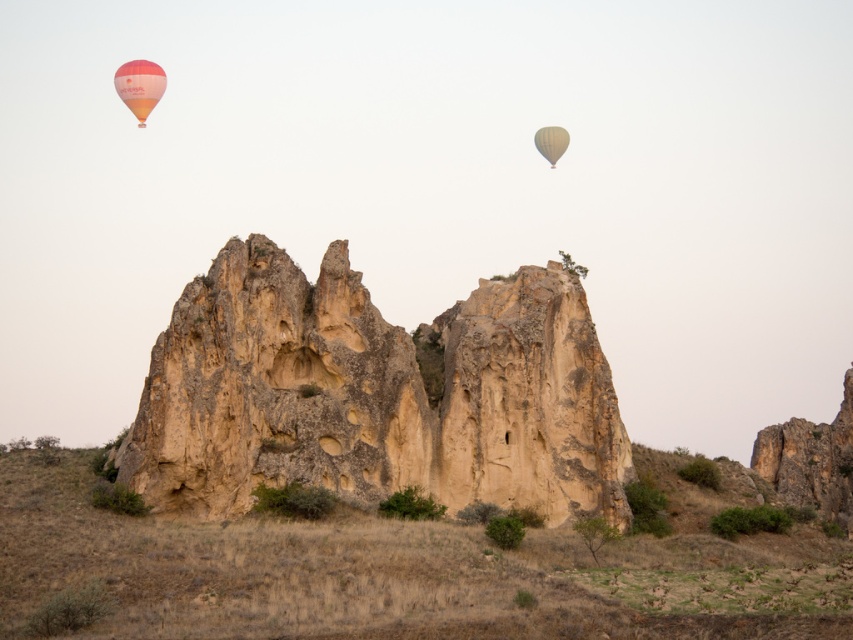
Question: Is matte orange balloon at upper left further to the viewer compared to matte yellow balloon at upper right?

Choices:
 (A) yes
 (B) no

Answer: (B)

Question: Can you confirm if matte orange balloon at upper left is positioned to the right of matte yellow balloon at upper right?

Choices:
 (A) no
 (B) yes

Answer: (A)

Question: Does matte orange balloon at upper left have a larger size compared to matte yellow balloon at upper right?

Choices:
 (A) yes
 (B) no

Answer: (A)

Question: Which object appears closest to the camera in this image?

Choices:
 (A) matte yellow balloon at upper right
 (B) matte orange balloon at upper left

Answer: (B)